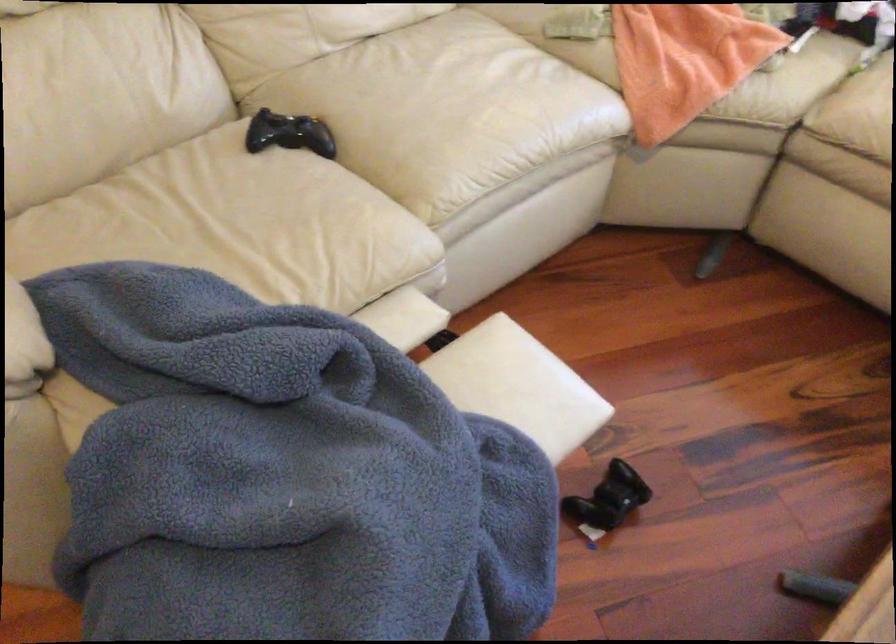
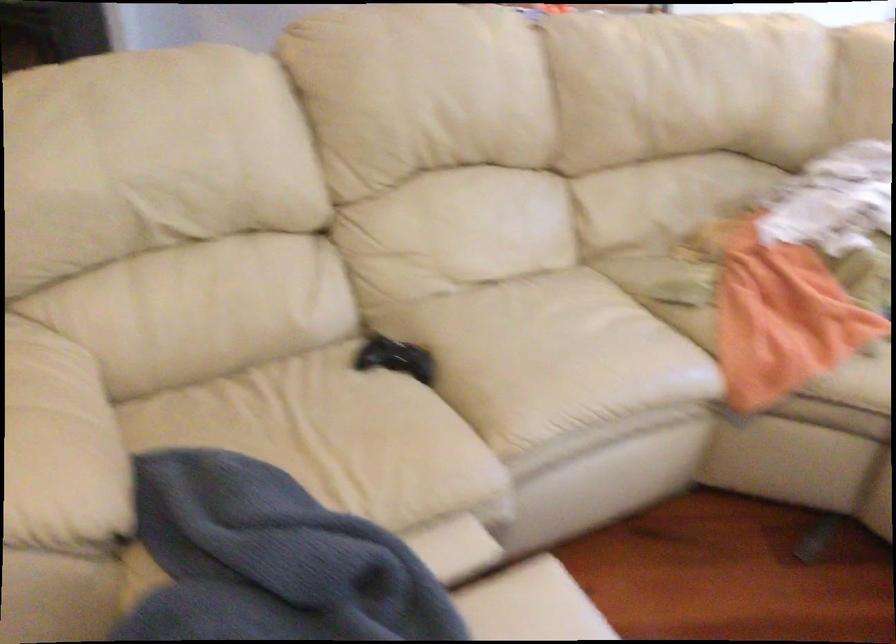
The images are taken continuously from a first-person perspective. In which direction are you moving?

The cameraman walked toward right, backward.